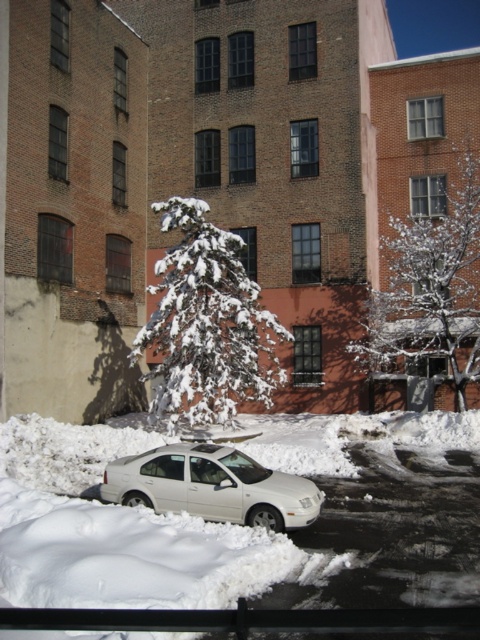
Question: Is the position of white fluffy snow at center less distant than that of white snowy tree at center?

Choices:
 (A) no
 (B) yes

Answer: (B)

Question: Can you confirm if white fluffy snow at center is smaller than white snow-covered tree at center?

Choices:
 (A) no
 (B) yes

Answer: (A)

Question: Is white snow-covered tree at center to the left of white snowy tree at center from the viewer's perspective?

Choices:
 (A) no
 (B) yes

Answer: (B)

Question: Based on their relative distances, which object is nearer to the white fluffy snow at center?

Choices:
 (A) white matte car at center
 (B) white snow-covered tree at center

Answer: (A)

Question: Which point appears farthest from the camera in this image?

Choices:
 (A) (334, 422)
 (B) (186, 212)
 (C) (132, 490)
 (D) (430, 342)

Answer: (D)

Question: Based on their relative distances, which object is nearer to the white matte car at center?

Choices:
 (A) white fluffy snow at center
 (B) white snowy tree at center

Answer: (A)